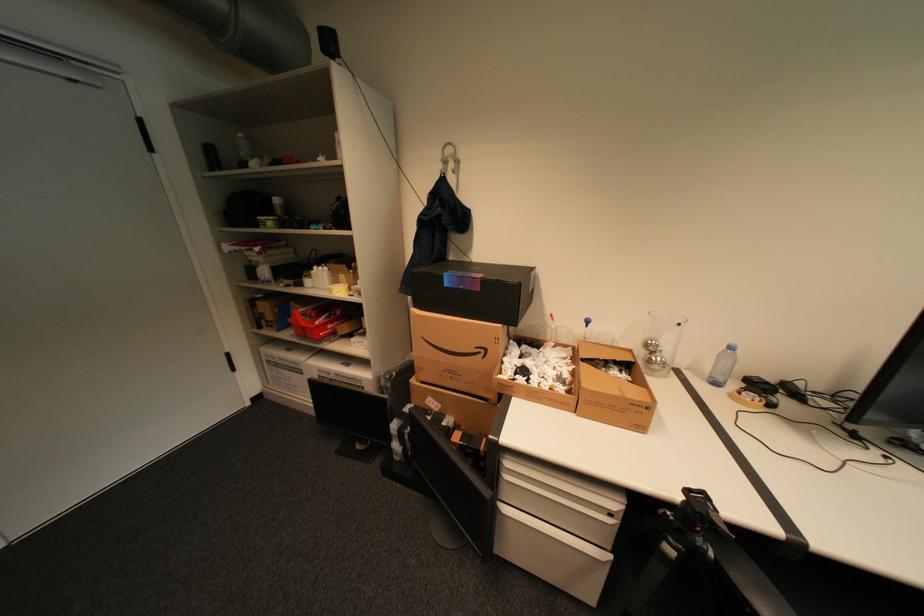
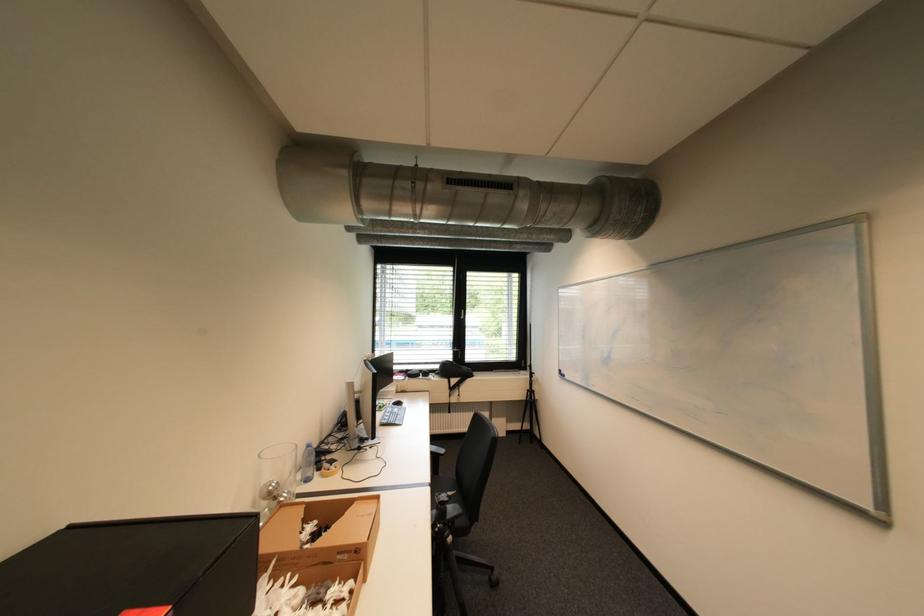
Locate, in the second image, the point that corresponds to point (677, 551) in the first image.

(458, 540)